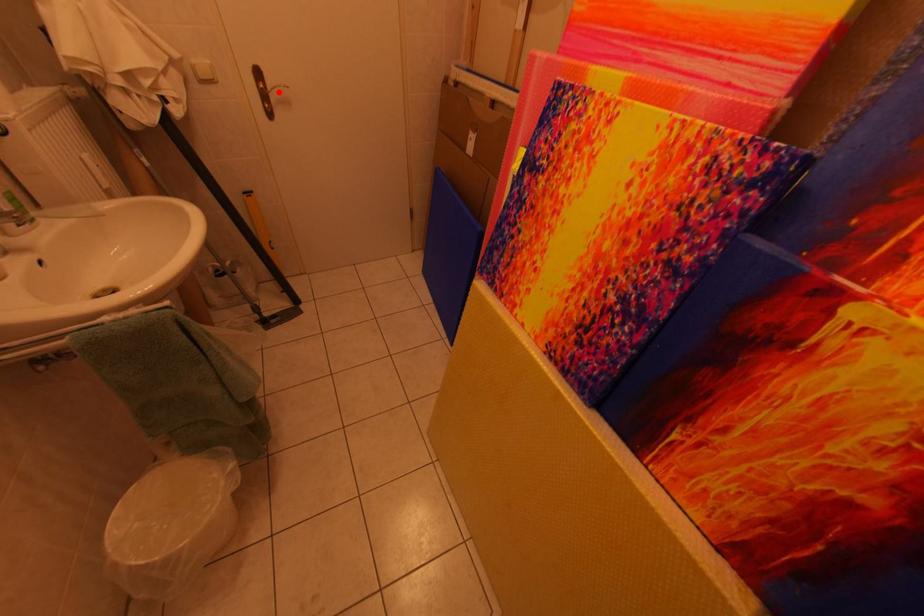
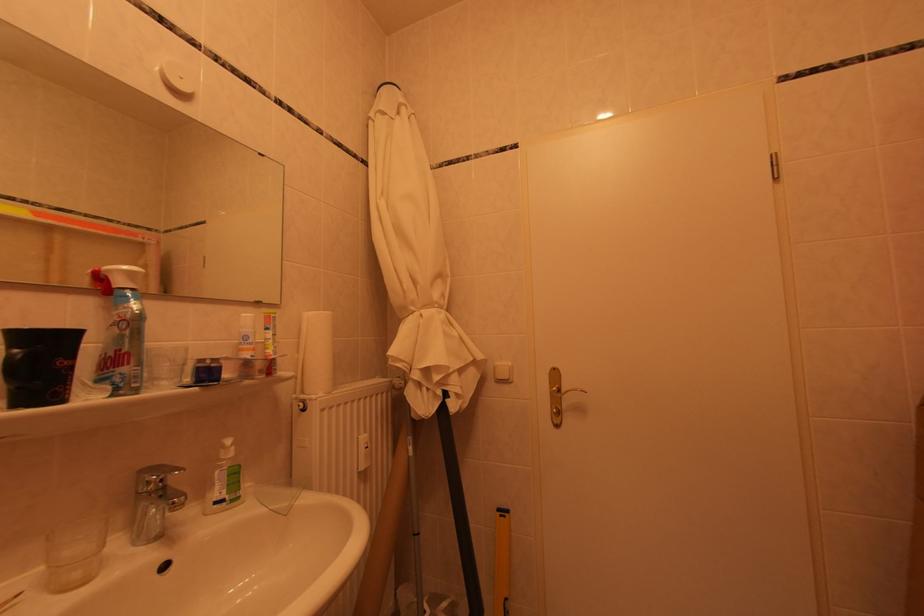
The point at the highlighted location is marked in the first image. Where is the corresponding point in the second image?

(572, 395)